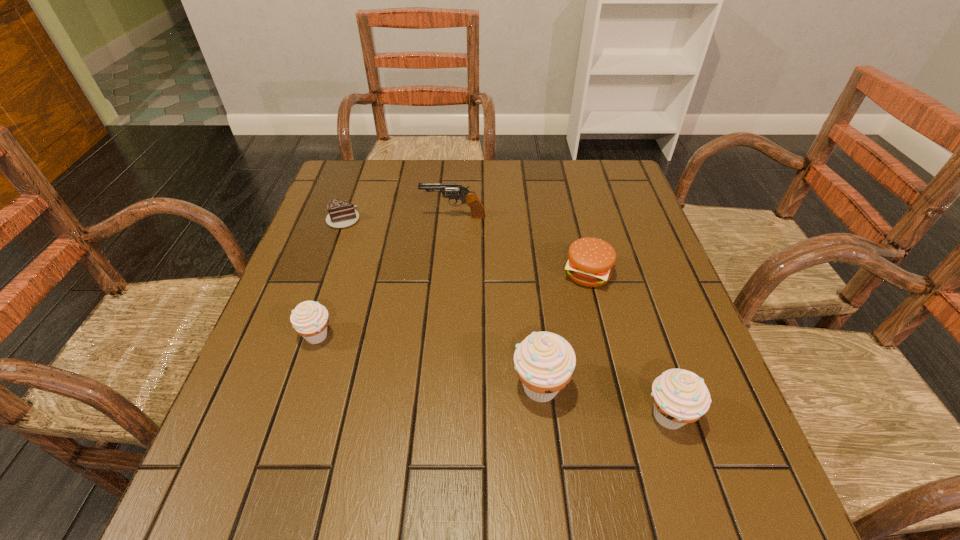
You are a GUI agent. You are given a task and a screenshot of the screen. Output one action in this format:
    pyautogui.click(x=<x>, y=<y>)
    Task: Click on the free point between the leftmost muffin and the fourth object from right to left
    This screenshot has width=960, height=540.
    Given the screenshot: What is the action you would take?
    pyautogui.click(x=386, y=276)

I want to click on vacant space that's between the second tallest muffin and the tallest muffin, so click(x=604, y=401).

You are a GUI agent. You are given a task and a screenshot of the screen. Output one action in this format:
    pyautogui.click(x=<x>, y=<y>)
    Task: Click on the vacant space that's between the farthest muffin and the shortest object
    
    Given the screenshot: What is the action you would take?
    pyautogui.click(x=330, y=277)

Locate an element on the screen. free area in between the tallest object and the third farthest object is located at coordinates (564, 330).

What are the coordinates of `free space between the third object from left to right and the chocolate cake` in the screenshot? It's located at (398, 218).

Locate an element on the screen. This screenshot has height=540, width=960. vacant space that's between the gun and the hamburger is located at coordinates (520, 245).

The image size is (960, 540). I want to click on object that is the fifth closest one to the chocolate cake, so click(680, 396).

The height and width of the screenshot is (540, 960). Identify the location of object that is the fourth closest to the third object from left to right. (544, 361).

Locate which muffin ranks in proximity to the fourth nearest object. Please provide its 2D coordinates. Your answer should be formatted as a tuple, i.e. [(x, y)], where the tuple contains the x and y coordinates of a point satisfying the conditions above.

[(544, 361)]

At what (x,y) coordinates should I click in order to perform the action: click on muffin object that ranks as the closest to the rightmost muffin. Please return your answer as a coordinate pair (x, y). The image size is (960, 540). Looking at the image, I should click on (544, 361).